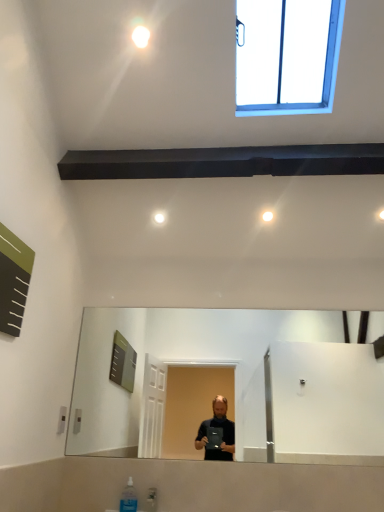
Question: From a real-world perspective, is green matte board at upper left on top of clear plastic bottle at lower center?

Choices:
 (A) yes
 (B) no

Answer: (A)

Question: Is green matte board at upper left not close to clear plastic bottle at lower center?

Choices:
 (A) no
 (B) yes

Answer: (B)

Question: From the image's perspective, is green matte board at upper left above clear plastic bottle at lower center?

Choices:
 (A) no
 (B) yes

Answer: (B)

Question: Is green matte board at upper left to the left of clear plastic bottle at lower center from the viewer's perspective?

Choices:
 (A) yes
 (B) no

Answer: (A)

Question: Is green matte board at upper left bigger than clear plastic bottle at lower center?

Choices:
 (A) no
 (B) yes

Answer: (B)

Question: Is green matte board at upper left taller or shorter than white glossy light bulb at upper center?

Choices:
 (A) short
 (B) tall

Answer: (B)

Question: From a real-world perspective, is green matte board at upper left physically located above or below white glossy light bulb at upper center?

Choices:
 (A) above
 (B) below

Answer: (B)

Question: From the image's perspective, is green matte board at upper left above or below white glossy light bulb at upper center?

Choices:
 (A) below
 (B) above

Answer: (A)

Question: Looking at their shapes, would you say green matte board at upper left is wider or thinner than white glossy light bulb at upper center?

Choices:
 (A) thin
 (B) wide

Answer: (A)

Question: Looking at their shapes, would you say clear plastic bottle at lower center is wider or thinner than blue plastic window at upper right?

Choices:
 (A) wide
 (B) thin

Answer: (B)

Question: Considering the positions of point (122, 508) and point (329, 103), is point (122, 508) closer or farther from the camera than point (329, 103)?

Choices:
 (A) closer
 (B) farther

Answer: (A)

Question: Relative to blue plastic window at upper right, is clear plastic bottle at lower center in front or behind?

Choices:
 (A) front
 (B) behind

Answer: (B)

Question: Visually, is clear plastic bottle at lower center positioned to the left or to the right of blue plastic window at upper right?

Choices:
 (A) left
 (B) right

Answer: (A)

Question: Is blue plastic window at upper right to the left or to the right of white glossy light bulb at upper center in the image?

Choices:
 (A) left
 (B) right

Answer: (B)

Question: Looking at their shapes, would you say blue plastic window at upper right is wider or thinner than white glossy light bulb at upper center?

Choices:
 (A) thin
 (B) wide

Answer: (B)